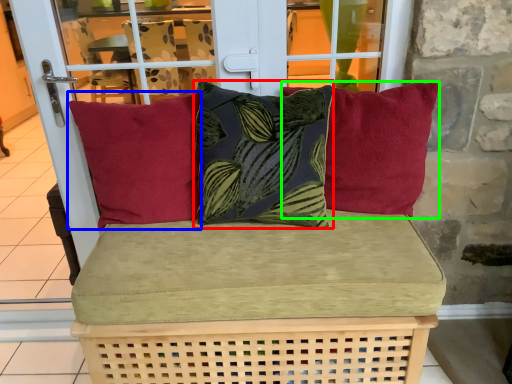
Question: Estimate the real-world distances between objects in this image. Which object is closer to pillow (highlighted by a red box), pillow (highlighted by a blue box) or pillow (highlighted by a green box)?

Choices:
 (A) pillow
 (B) pillow

Answer: (A)